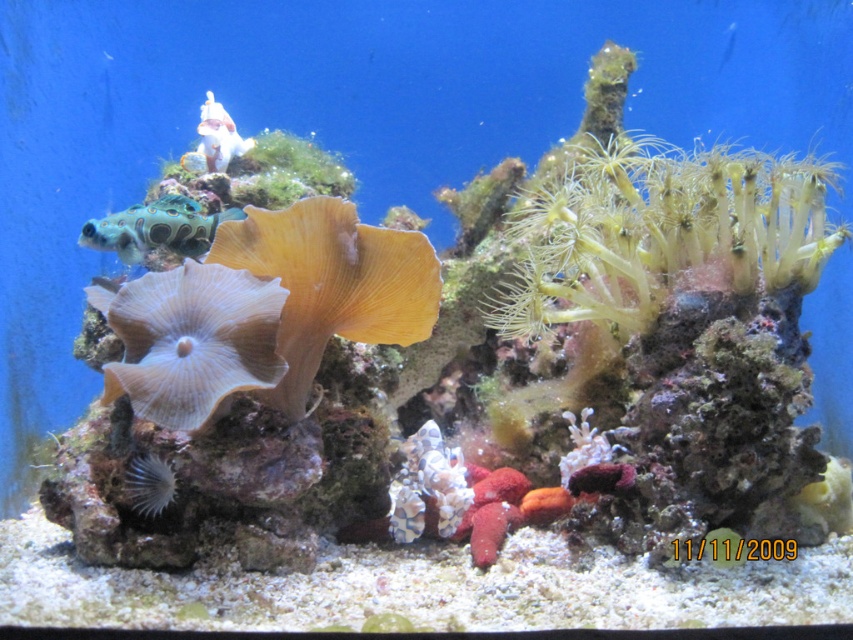
Question: Among these points, which one is nearest to the camera?

Choices:
 (A) (549, 180)
 (B) (187, 424)
 (C) (239, 134)
 (D) (450, 504)

Answer: (B)

Question: Is translucent yellow anemone at center-right smaller than white glossy statue at upper center?

Choices:
 (A) no
 (B) yes

Answer: (A)

Question: Does translucent yellow anemone at center-right appear over white glossy statue at upper center?

Choices:
 (A) no
 (B) yes

Answer: (A)

Question: Which point is closer to the camera?

Choices:
 (A) (630, 179)
 (B) (219, 122)
 (C) (84, 232)

Answer: (C)

Question: Which point is closer to the camera?

Choices:
 (A) (146, 470)
 (B) (158, 236)
 (C) (410, 490)
 (D) (184, 330)

Answer: (D)

Question: Can you confirm if translucent yellow coral at center is positioned above speckled shell at center?

Choices:
 (A) no
 (B) yes

Answer: (B)